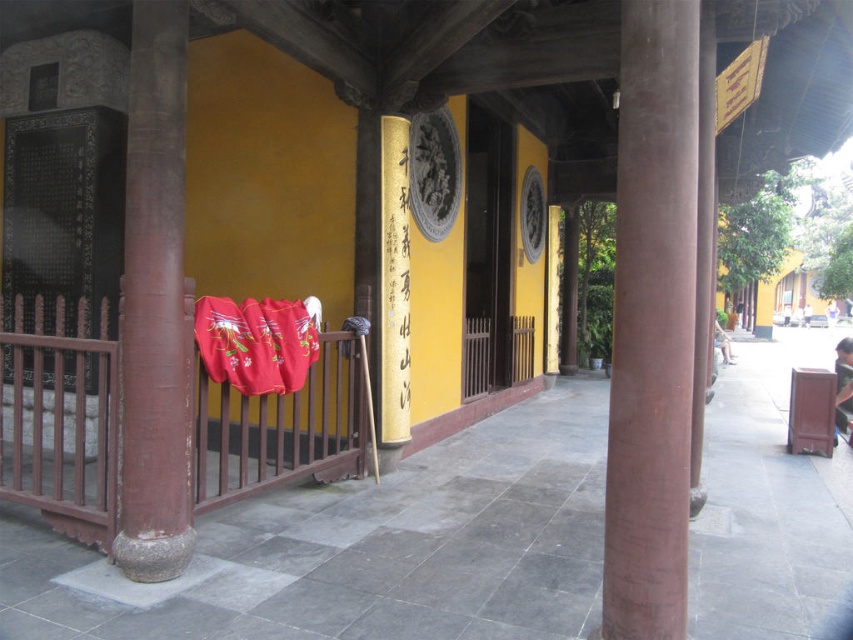
Question: Which object appears farthest from the camera in this image?

Choices:
 (A) velvet red blanket at center
 (B) smooth brown pillar at left
 (C) brown wooden door at center
 (D) gold paper scroll at center

Answer: (C)

Question: Does velvet red blanket at center have a greater width compared to gold paper scroll at center?

Choices:
 (A) no
 (B) yes

Answer: (B)

Question: Among these points, which one is nearest to the camera?

Choices:
 (A) (331, 378)
 (B) (664, 381)
 (C) (387, 385)

Answer: (B)

Question: Is smooth wooden rail at center left positioned before smooth brown pillar at left?

Choices:
 (A) no
 (B) yes

Answer: (A)

Question: Is the position of velvet red blanket at center less distant than that of gold paper scroll at center?

Choices:
 (A) no
 (B) yes

Answer: (B)

Question: Estimate the real-world distances between objects in this image. Which object is closer to the smooth brown pillar at center?

Choices:
 (A) smooth brown pillar at left
 (B) velvet red blanket at center

Answer: (A)